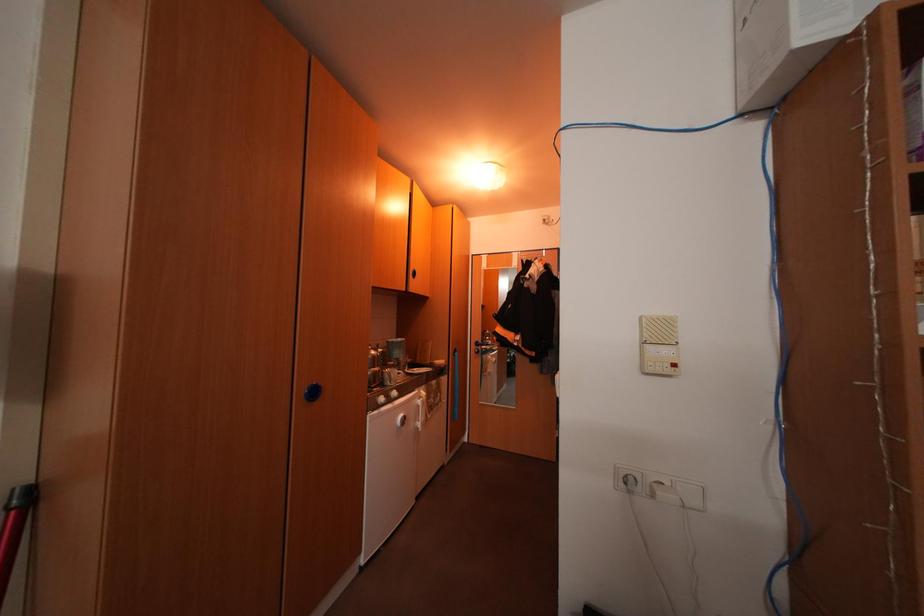
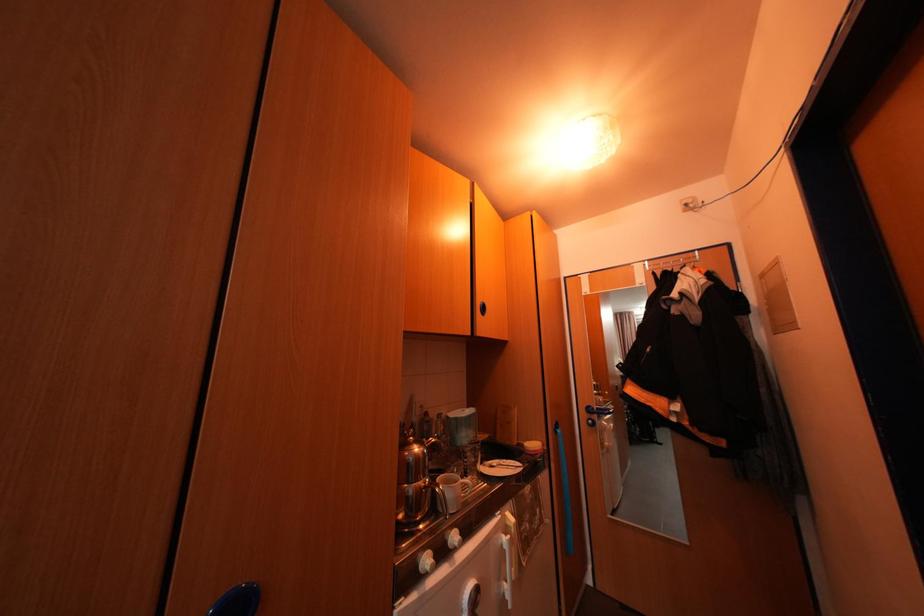
Question: How did the camera likely rotate?

Choices:
 (A) Left
 (B) Right
 (C) Up
 (D) Down

Answer: (A)